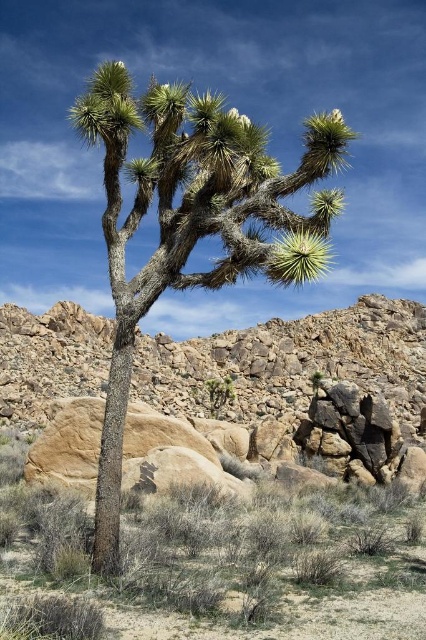
Which is more to the right, brown textured rock at center or green spiky tree at center?

brown textured rock at center

This screenshot has width=426, height=640. In order to click on brown textured rock at center in this screenshot , I will do `click(218, 566)`.